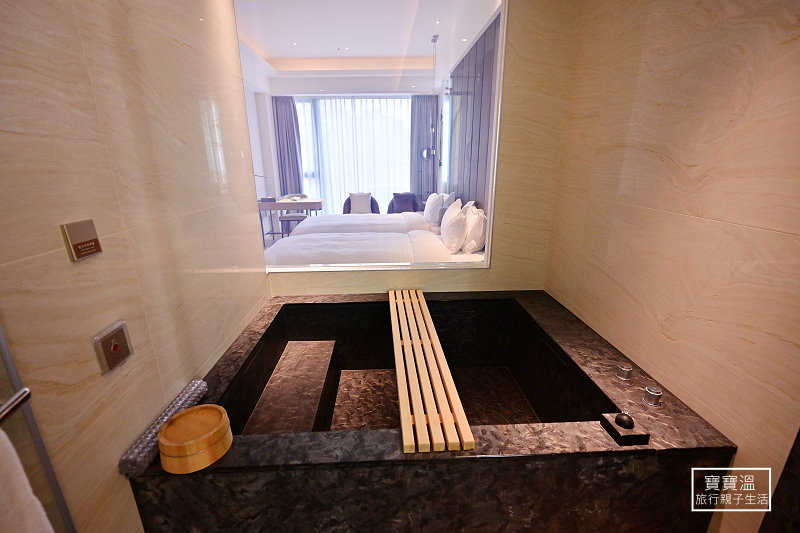
What are the coordinates of `beds` in the screenshot? It's located at (362, 248), (362, 218).